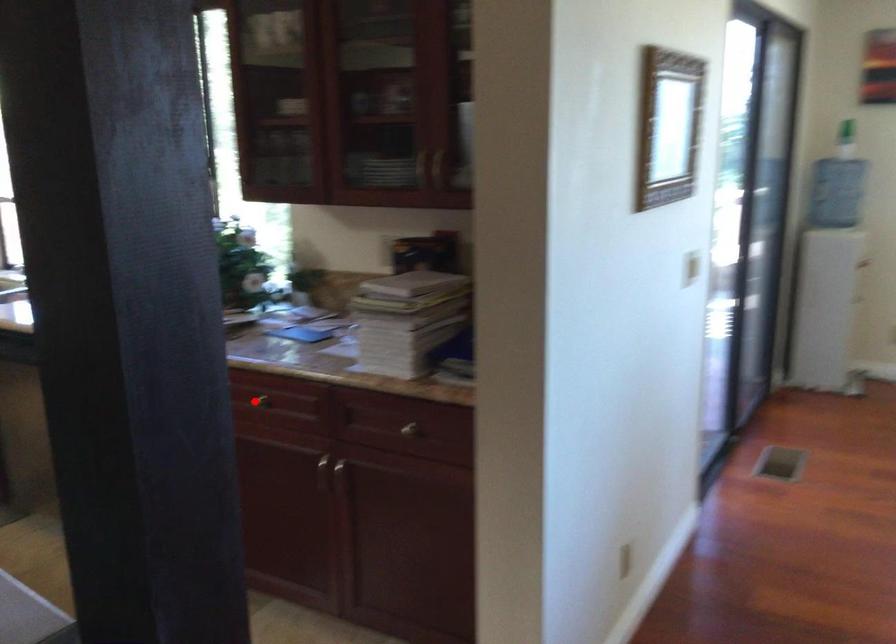
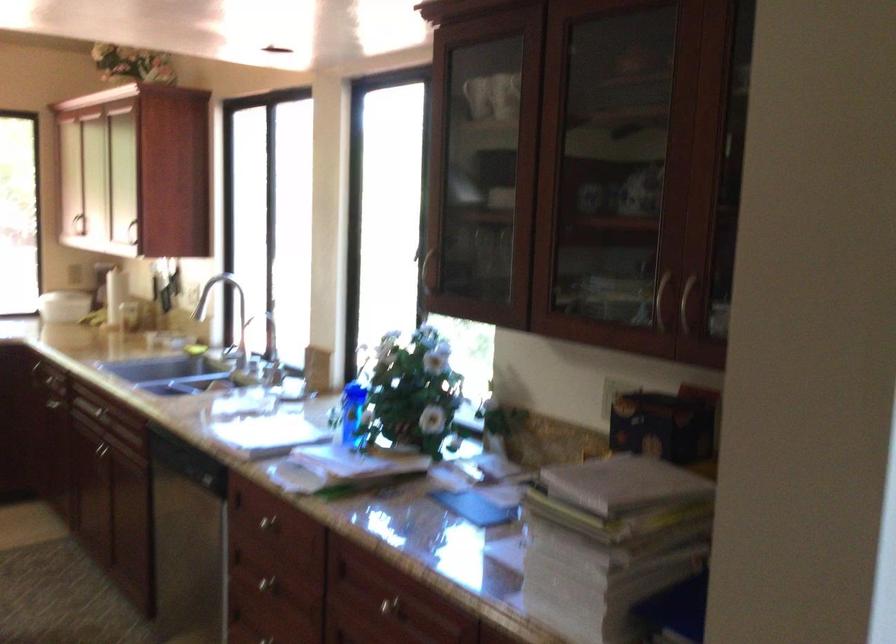
Question: I am providing you with two images of the same scene from different viewpoints. A red point is shown in image1. For the corresponding object point in image2, is it positioned nearer or farther from the camera?

Choices:
 (A) Nearer
 (B) Farther

Answer: (A)